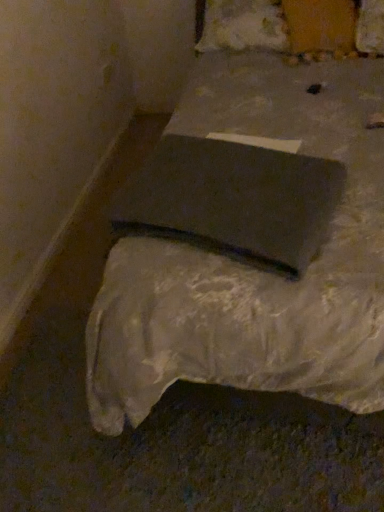
Measure the distance between white cotton pillow at upper center and camera.

white cotton pillow at upper center is 1.94 meters from camera.

In order to face white cotton pillow at upper center, should I rotate leftwards or rightwards?

It's best to rotate right around 10.216 degrees.

The image size is (384, 512). In order to click on matte gray bed at center in this screenshot , I will do `click(252, 270)`.

What do you see at coordinates (252, 270) in the screenshot? I see `matte gray bed at center` at bounding box center [252, 270].

At what (x,y) coordinates should I click in order to perform the action: click on matte gray pad at center. Please return your answer as a coordinate pair (x, y). The width and height of the screenshot is (384, 512). Looking at the image, I should click on (233, 201).

From a real-world perspective, which is physically above, white cotton pillow at upper center or matte gray pad at center?

white cotton pillow at upper center is physically above.

Is white cotton pillow at upper center facing towards matte gray pad at center?

Yes.

How much distance is there between white cotton pillow at upper center and matte gray pad at center?

white cotton pillow at upper center is 4.01 feet away from matte gray pad at center.

Is white cotton pillow at upper center surrounding matte gray pad at center?

No.

Find the location of a particular element. The height and width of the screenshot is (512, 384). pad that is below the matte gray bed at center (from the image's perspective) is located at coordinates (233, 201).

Is the position of matte gray bed at center more distant than that of matte gray pad at center?

No, matte gray bed at center is closer to the camera.

Which object is positioned more to the left, matte gray bed at center or matte gray pad at center?

From the viewer's perspective, matte gray pad at center appears more on the left side.

How different are the orientations of matte gray bed at center and matte gray pad at center in degrees?

17.1 degrees.

Is matte gray bed at center at the back of white cotton pillow at upper center?

Absolutely, white cotton pillow at upper center is directed away from matte gray bed at center.

What's the angular difference between white cotton pillow at upper center and matte gray bed at center's facing directions?

The angular difference between white cotton pillow at upper center and matte gray bed at center is 0.183 degrees.

From the image's perspective, who appears lower, white cotton pillow at upper center or matte gray bed at center?

matte gray bed at center is shown below in the image.

What's the angular difference between matte gray bed at center and white cotton pillow at upper center's facing directions?

They differ by 0.183 degrees in their facing directions.

Looking at this image, is matte gray bed at center inside the boundaries of white cotton pillow at upper center, or outside?

matte gray bed at center is spatially situated outside white cotton pillow at upper center.

From the picture: From a real-world perspective, is matte gray bed at center over white cotton pillow at upper center?

No, from a real-world perspective, matte gray bed at center is not on top of white cotton pillow at upper center.

Find the location of a particular element. Image resolution: width=384 pixels, height=512 pixels. bed below the matte gray pad at center (from a real-world perspective) is located at coordinates (252, 270).

In the image, is matte gray pad at center positioned in front of or behind matte gray bed at center?

In the image, matte gray pad at center appears behind matte gray bed at center.

Does matte gray pad at center appear on the right side of matte gray bed at center?

No.

Does matte gray pad at center have a lesser width compared to matte gray bed at center?

Indeed, matte gray pad at center has a lesser width compared to matte gray bed at center.

From the image's perspective, between matte gray pad at center and white cotton pillow at upper center, which one is located above?

white cotton pillow at upper center, from the image's perspective.

In the image, is matte gray pad at center on the left side or the right side of white cotton pillow at upper center?

matte gray pad at center is to the left of white cotton pillow at upper center.

Identify the location of pad in front of the white cotton pillow at upper center. (233, 201).

At what (x,y) coordinates should I click in order to perform the action: click on pad on the left of white cotton pillow at upper center. Please return your answer as a coordinate pair (x, y). Looking at the image, I should click on (233, 201).

Find the location of a particular element. bed on the right of matte gray pad at center is located at coordinates (252, 270).

From the picture: Which object lies further to the anchor point matte gray bed at center, matte gray pad at center or white cotton pillow at upper center?

white cotton pillow at upper center is further to matte gray bed at center.

Looking at this image, when comparing their distances from matte gray pad at center, does white cotton pillow at upper center or matte gray bed at center seem further?

white cotton pillow at upper center is positioned further to the anchor matte gray pad at center.

When comparing their distances from white cotton pillow at upper center, does matte gray bed at center or matte gray pad at center seem closer?

The object closer to white cotton pillow at upper center is matte gray bed at center.

Considering their positions, is white cotton pillow at upper center positioned further to matte gray bed at center than matte gray pad at center?

The object further to matte gray bed at center is white cotton pillow at upper center.

From the image, which object appears to be farther from white cotton pillow at upper center, matte gray pad at center or matte gray bed at center?

matte gray pad at center is further to white cotton pillow at upper center.

Looking at this image, based on their spatial positions, is matte gray bed at center or white cotton pillow at upper center further from matte gray pad at center?

white cotton pillow at upper center is further to matte gray pad at center.

Where is `pad between matte gray bed at center and white cotton pillow at upper center in the front-back direction`? Image resolution: width=384 pixels, height=512 pixels. pad between matte gray bed at center and white cotton pillow at upper center in the front-back direction is located at coordinates (233, 201).